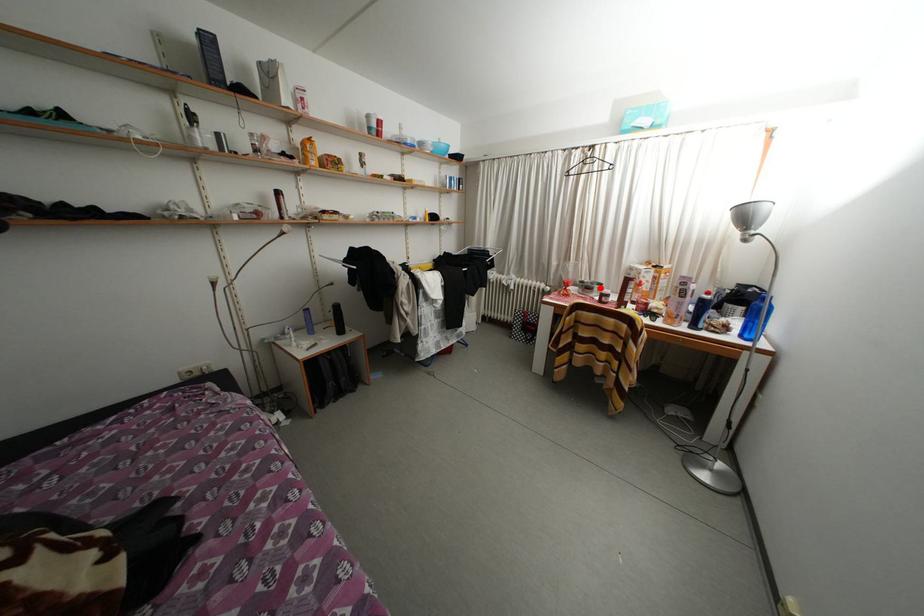
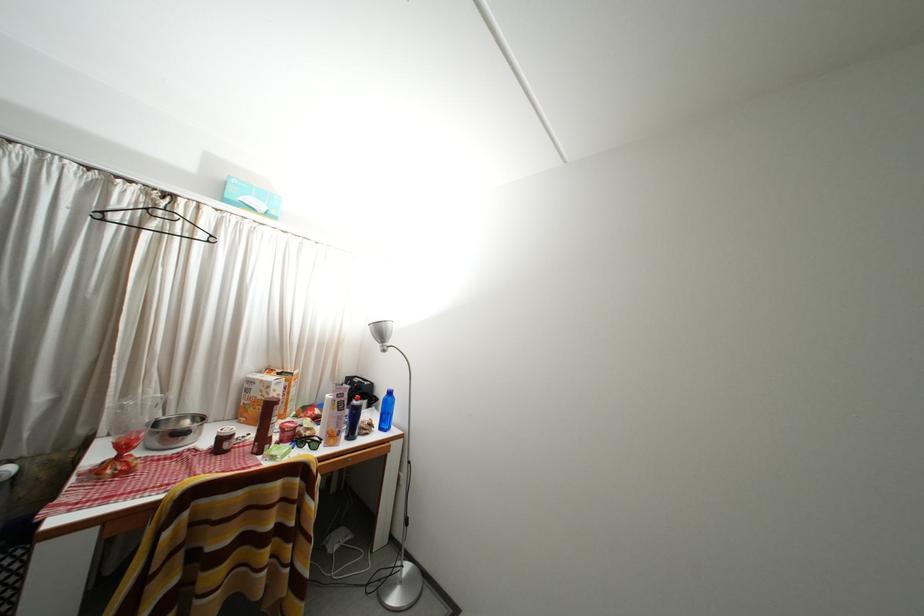
The point at the highlighted location is marked in the first image. Where is the corresponding point in the second image?

(188, 424)